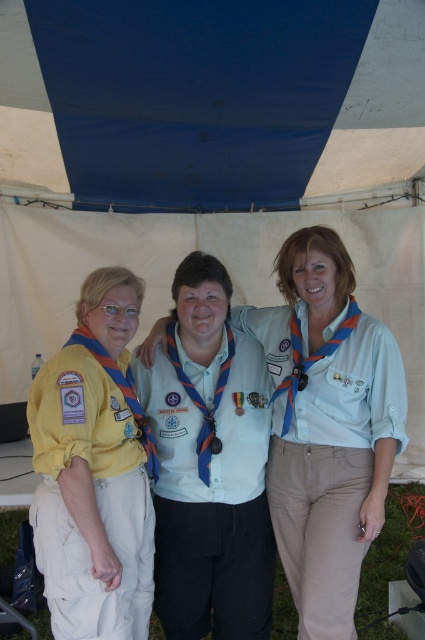
Question: Considering the relative positions of light blue cotton shirt at center and blue fabric canopy at upper center in the image provided, where is light blue cotton shirt at center located with respect to blue fabric canopy at upper center?

Choices:
 (A) left
 (B) right

Answer: (A)

Question: Which of these objects is positioned closest to the blue fabric canopy at upper center?

Choices:
 (A) blue fabric uniform at center
 (B) yellow fabric uniform at left
 (C) light blue cotton shirt at center

Answer: (C)

Question: Does blue fabric uniform at center appear over yellow fabric uniform at left?

Choices:
 (A) yes
 (B) no

Answer: (B)

Question: Which is farther from the blue fabric uniform at center?

Choices:
 (A) yellow fabric uniform at left
 (B) light blue cotton shirt at center
 (C) blue fabric canopy at upper center

Answer: (C)

Question: Which of the following is the farthest from the observer?

Choices:
 (A) (314, 609)
 (B) (144, 563)
 (C) (401, 97)
 (D) (237, 532)

Answer: (C)

Question: Can you confirm if yellow fabric uniform at left is smaller than blue fabric canopy at upper center?

Choices:
 (A) no
 (B) yes

Answer: (B)